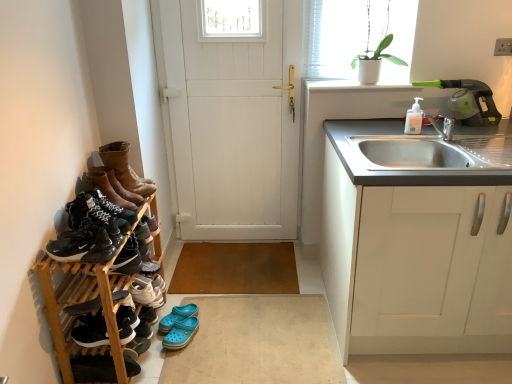
Locate an element on the screen. This screenshot has width=512, height=384. unoccupied region to the right of blue rubber clogs at lower center, the 8th footwear viewed from the top is located at coordinates (215, 316).